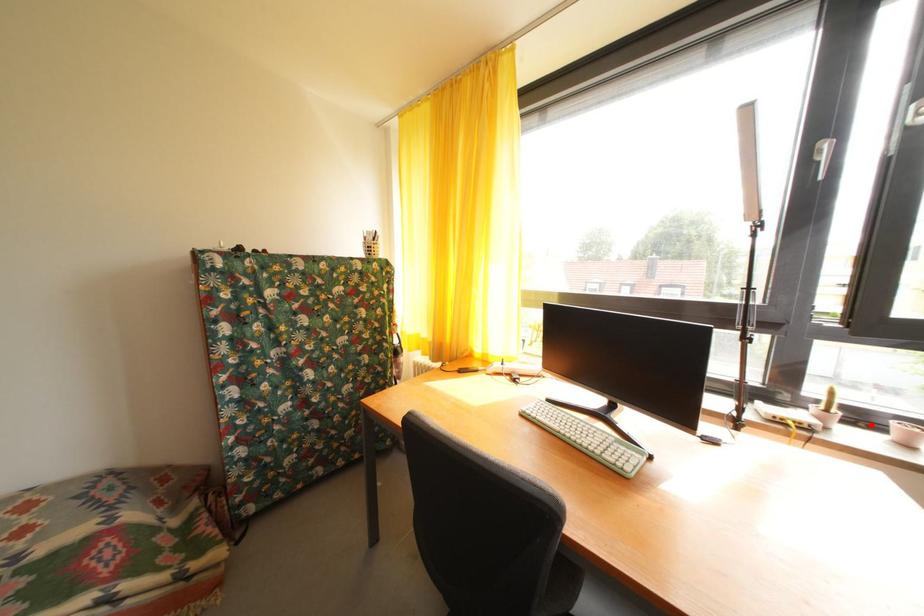
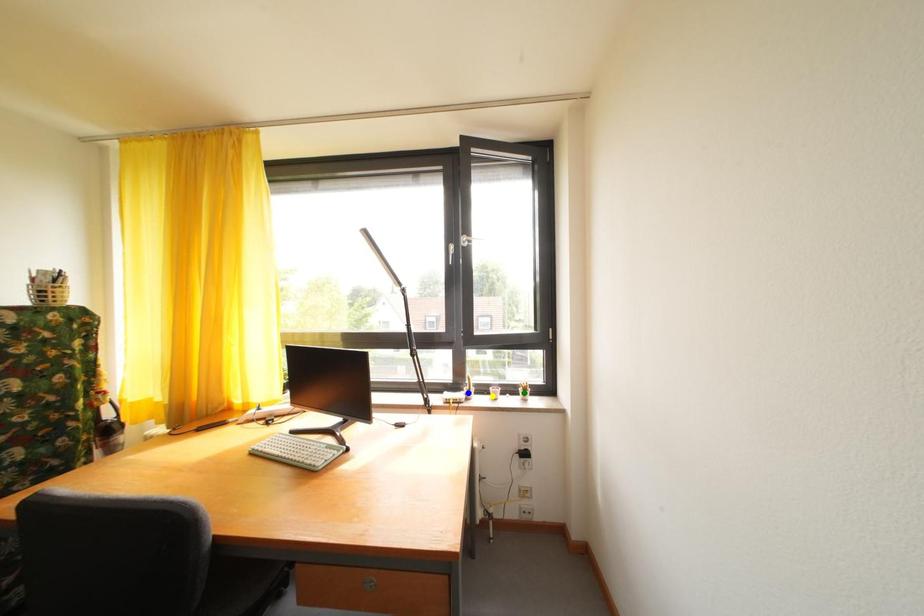
Question: I am providing you with two images of the same scene from different viewpoints. A red point is marked on the first image. You are given multiple points on the second image. Which spot in image 2 lines up with the point in image 1?

Choices:
 (A) green point
 (B) yellow point
 (C) blue point

Answer: (B)